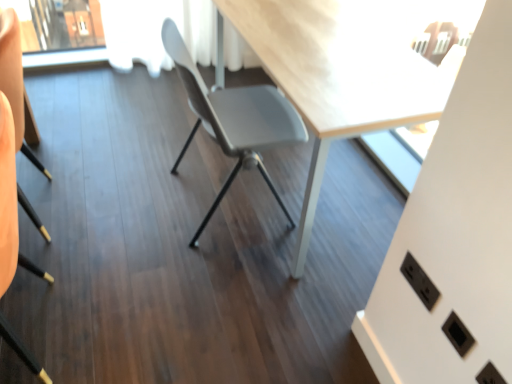
Question: Is black matte chair at lower left, the 1th chair viewed from the left, shorter than matte gray chair at center, which is the first chair from right to left?

Choices:
 (A) yes
 (B) no

Answer: (B)

Question: Is black matte chair at lower left, which appears as the second chair when viewed from the right, with matte gray chair at center, which is the first chair from right to left?

Choices:
 (A) no
 (B) yes

Answer: (A)

Question: From the image's perspective, is black matte chair at lower left, which appears as the second chair when viewed from the right, over matte gray chair at center, which is the first chair from right to left?

Choices:
 (A) yes
 (B) no

Answer: (B)

Question: Is black matte chair at lower left, the 1th chair viewed from the left, turned away from matte gray chair at center, which is the first chair from right to left?

Choices:
 (A) yes
 (B) no

Answer: (B)

Question: From the image's perspective, would you say black matte chair at lower left, the 1th chair viewed from the left, is shown under matte gray chair at center, which is the first chair from right to left?

Choices:
 (A) yes
 (B) no

Answer: (A)

Question: Is black matte chair at lower left, the 1th chair viewed from the left, bigger than matte gray chair at center, the 2th chair viewed from the left?

Choices:
 (A) yes
 (B) no

Answer: (B)

Question: Does black plastic electric outlet at lower right come in front of matte gray chair at center, the 2th chair viewed from the left?

Choices:
 (A) no
 (B) yes

Answer: (B)

Question: Would you consider black plastic electric outlet at lower right to be distant from matte gray chair at center, which is the first chair from right to left?

Choices:
 (A) no
 (B) yes

Answer: (A)

Question: Does black plastic electric outlet at lower right have a lesser height compared to matte gray chair at center, the 2th chair viewed from the left?

Choices:
 (A) no
 (B) yes

Answer: (B)

Question: Is black plastic electric outlet at lower right thinner than matte gray chair at center, which is the first chair from right to left?

Choices:
 (A) no
 (B) yes

Answer: (B)

Question: Does black plastic electric outlet at lower right appear on the right side of matte gray chair at center, the 2th chair viewed from the left?

Choices:
 (A) yes
 (B) no

Answer: (A)

Question: From the image's perspective, would you say black plastic electric outlet at lower right is positioned over matte gray chair at center, which is the first chair from right to left?

Choices:
 (A) yes
 (B) no

Answer: (B)

Question: Is black plastic electric outlet at lower right taller than black matte chair at lower left, the 1th chair viewed from the left?

Choices:
 (A) no
 (B) yes

Answer: (A)